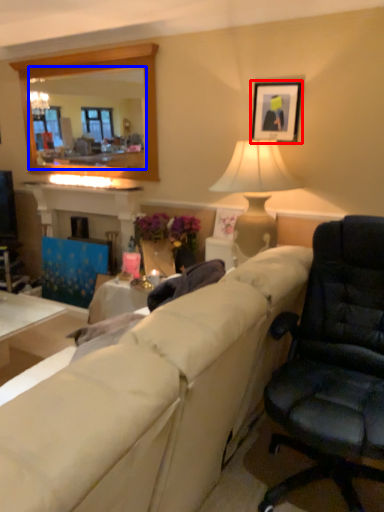
Question: Which object appears farthest to the camera in this image, picture frame (highlighted by a red box) or mirror (highlighted by a blue box)?

Choices:
 (A) picture frame
 (B) mirror

Answer: (B)